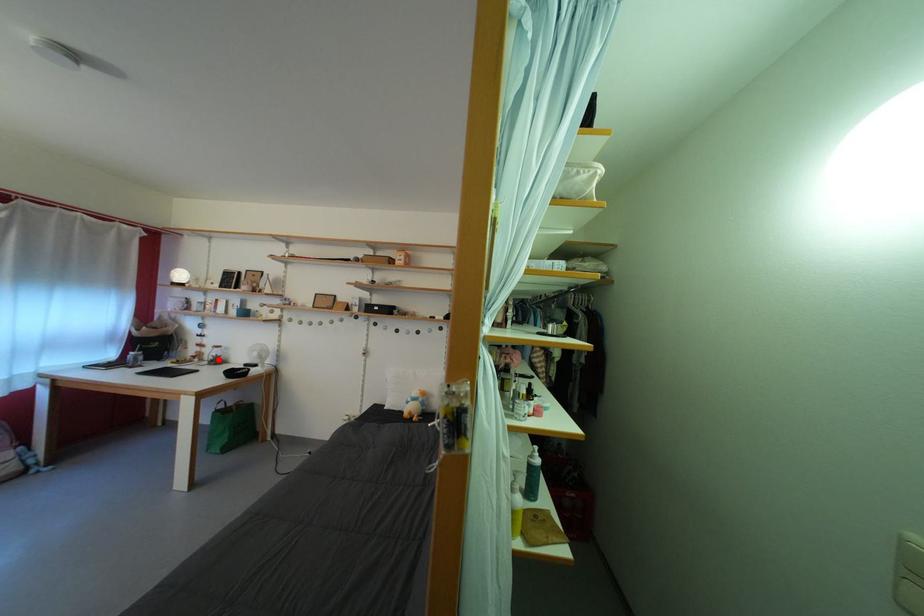
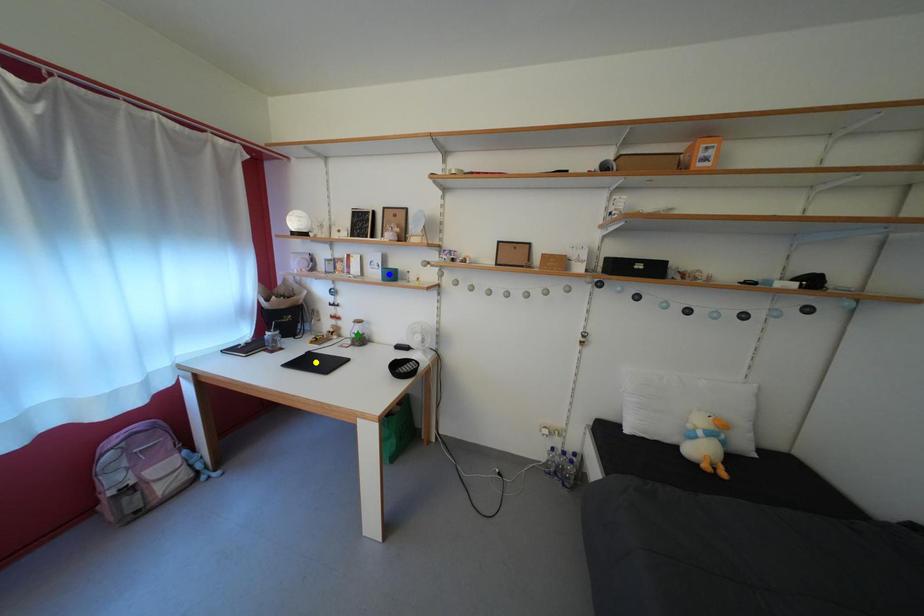
Question: I am providing you with two images of the same scene from different viewpoints. A red point is marked on the first image. You are given multiple points on the second image. Which point in image 2 represents the same 3d spot as the red point in image 1?

Choices:
 (A) green point
 (B) yellow point
 (C) blue point

Answer: (A)